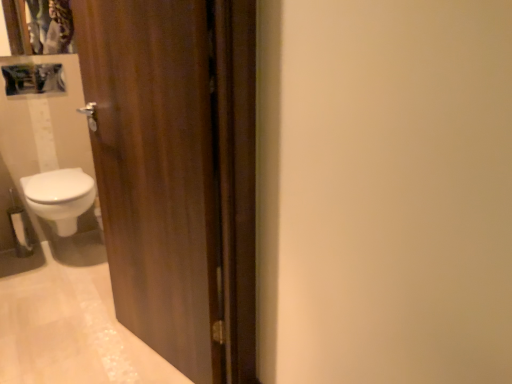
Question: Does matte plastic medicine cabinet at upper left have a greater height compared to white glossy bidet at lower left?

Choices:
 (A) no
 (B) yes

Answer: (A)

Question: Does matte plastic medicine cabinet at upper left have a greater width compared to white glossy bidet at lower left?

Choices:
 (A) yes
 (B) no

Answer: (B)

Question: Can you confirm if matte plastic medicine cabinet at upper left is positioned to the right of white glossy bidet at lower left?

Choices:
 (A) no
 (B) yes

Answer: (A)

Question: Is matte plastic medicine cabinet at upper left positioned behind white glossy bidet at lower left?

Choices:
 (A) yes
 (B) no

Answer: (A)

Question: Would you say matte plastic medicine cabinet at upper left is a long distance from white glossy bidet at lower left?

Choices:
 (A) no
 (B) yes

Answer: (A)

Question: Is matte plastic medicine cabinet at upper left oriented towards white glossy bidet at lower left?

Choices:
 (A) yes
 (B) no

Answer: (B)

Question: Does white matte toilet paper at lower left have a lesser width compared to matte plastic medicine cabinet at upper left?

Choices:
 (A) no
 (B) yes

Answer: (B)

Question: Is white matte toilet paper at lower left further to camera compared to matte plastic medicine cabinet at upper left?

Choices:
 (A) yes
 (B) no

Answer: (A)

Question: Considering the relative sizes of white matte toilet paper at lower left and matte plastic medicine cabinet at upper left in the image provided, is white matte toilet paper at lower left smaller than matte plastic medicine cabinet at upper left?

Choices:
 (A) no
 (B) yes

Answer: (B)

Question: Can you confirm if white matte toilet paper at lower left is taller than matte plastic medicine cabinet at upper left?

Choices:
 (A) no
 (B) yes

Answer: (B)

Question: From a real-world perspective, is white matte toilet paper at lower left located beneath matte plastic medicine cabinet at upper left?

Choices:
 (A) no
 (B) yes

Answer: (B)

Question: From a real-world perspective, is white matte toilet paper at lower left on matte plastic medicine cabinet at upper left?

Choices:
 (A) no
 (B) yes

Answer: (A)

Question: From a real-world perspective, does white matte toilet paper at lower left sit lower than wooden door at left?

Choices:
 (A) yes
 (B) no

Answer: (A)